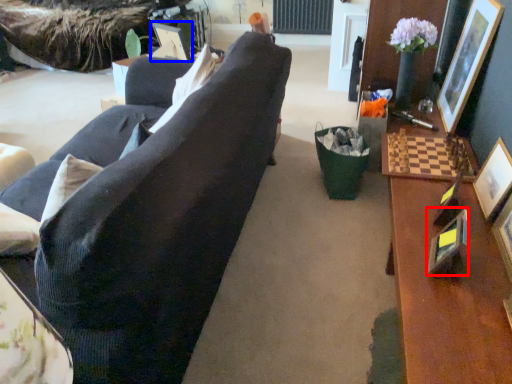
Question: Which object appears farthest to the camera in this image, picture frame (highlighted by a red box) or picture frame (highlighted by a blue box)?

Choices:
 (A) picture frame
 (B) picture frame

Answer: (B)